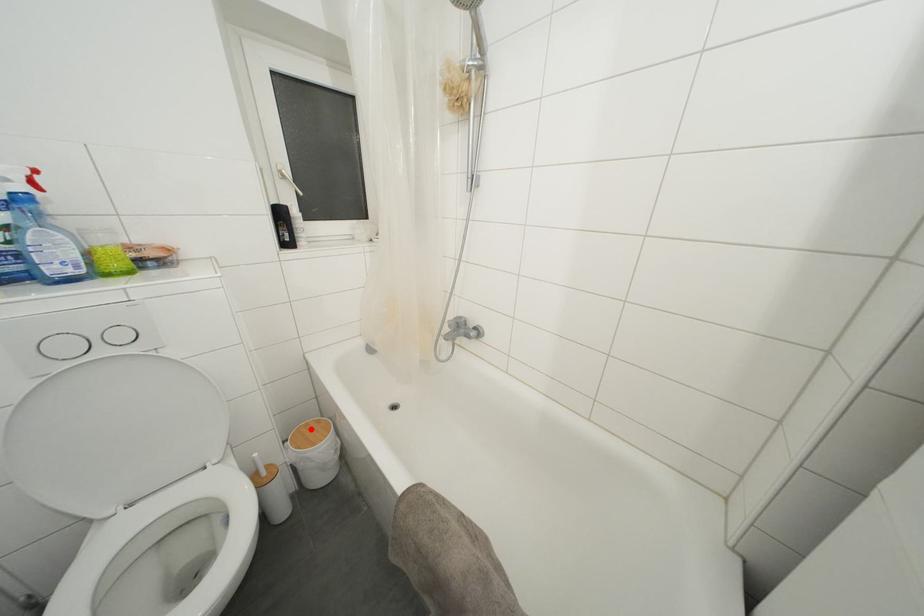
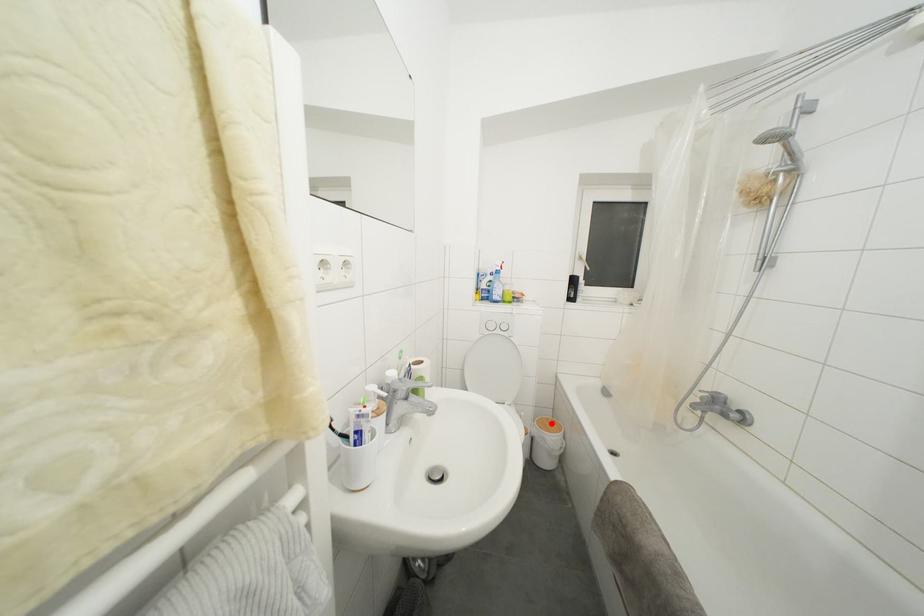
I am providing you with two images of the same scene from different viewpoints. A red point is marked on the first image and another point is marked on the second image. Is the red point in image1 aligned with the point shown in image2?

Yes